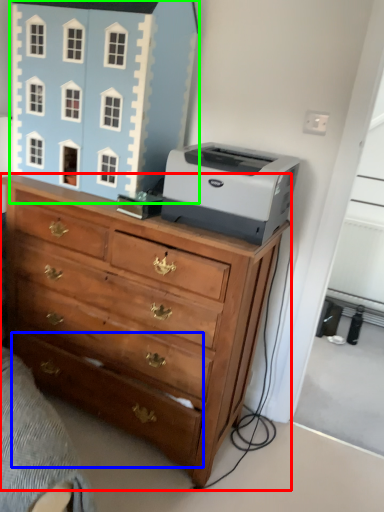
Question: Considering the real-world distances, which object is closest to chest of drawers (highlighted by a red box)? drawer (highlighted by a blue box) or toy (highlighted by a green box).

Choices:
 (A) drawer
 (B) toy

Answer: (A)